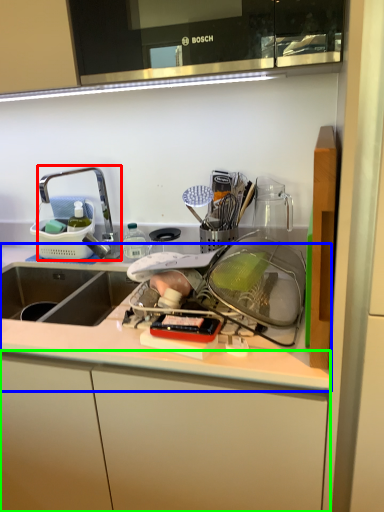
Question: Considering the real-world distances, which object is farthest from tap (highlighted by a red box)? countertop (highlighted by a blue box) or cabinetry (highlighted by a green box)?

Choices:
 (A) countertop
 (B) cabinetry

Answer: (B)